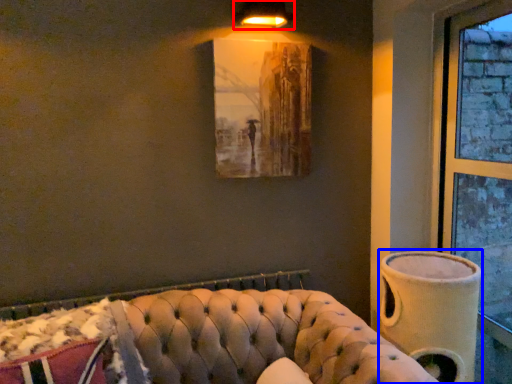
Question: Which of the following is the farthest to the observer, lamp (highlighted by a red box) or vase (highlighted by a blue box)?

Choices:
 (A) lamp
 (B) vase

Answer: (A)